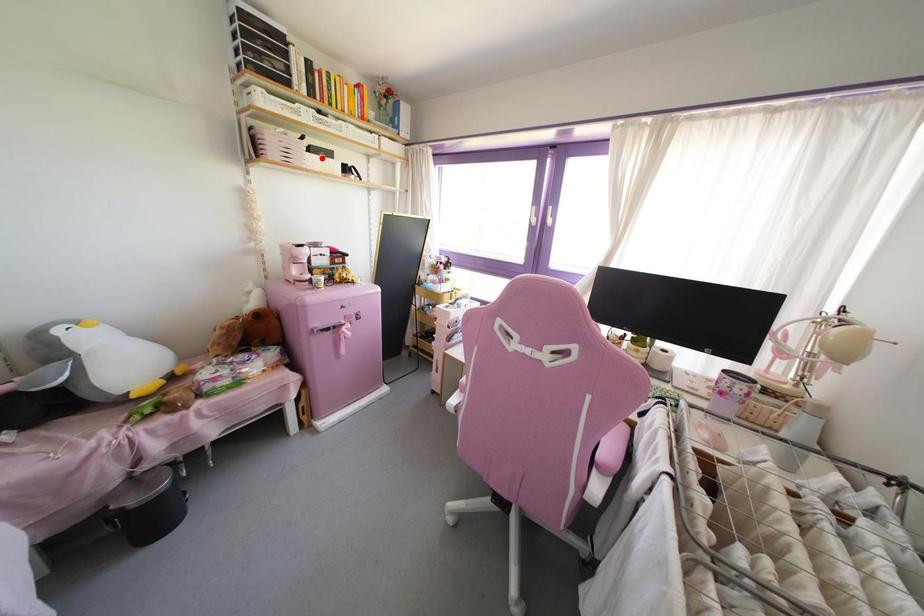
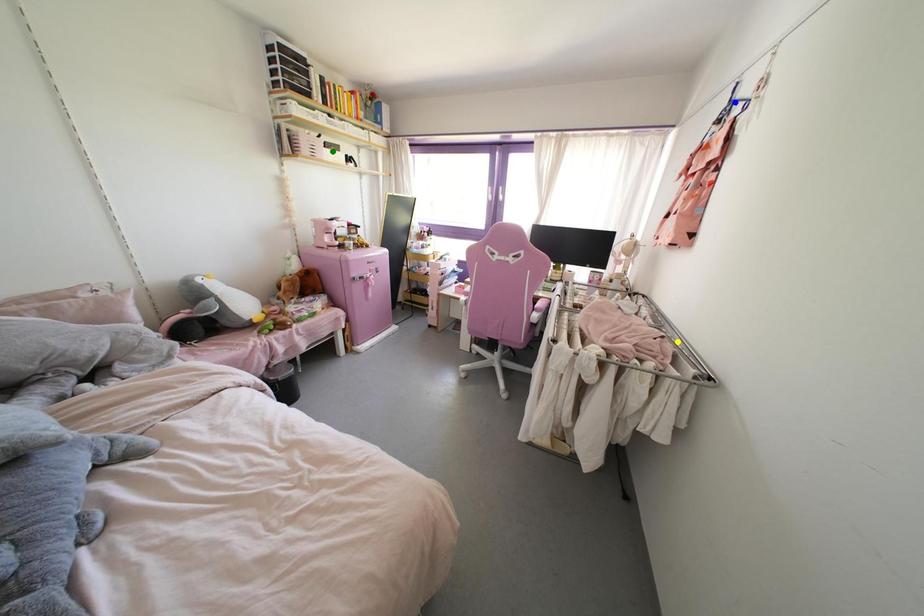
Question: I am providing you with two images of the same scene from different viewpoints. A red point is marked on the first image. You are given multiple points on the second image. Which point in image 2 represents the same 3d spot as the red point in image 1?

Choices:
 (A) green point
 (B) blue point
 (C) yellow point

Answer: (A)